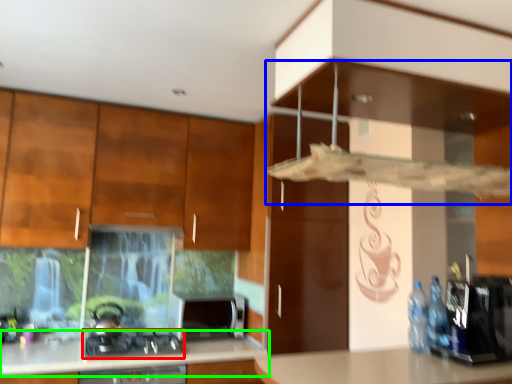
Question: Considering the real-world distances, which object is closest to gas stove (highlighted by a red box)? vent (highlighted by a blue box) or countertop (highlighted by a green box).

Choices:
 (A) vent
 (B) countertop

Answer: (B)